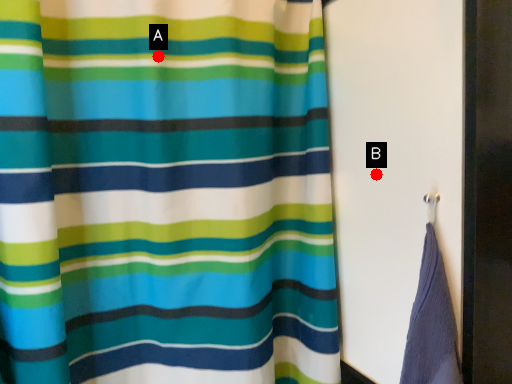
Question: Two points are circled on the image, labeled by A and B beside each circle. Which of the following is the farthest from the observer?

Choices:
 (A) A is further
 (B) B is further

Answer: (B)